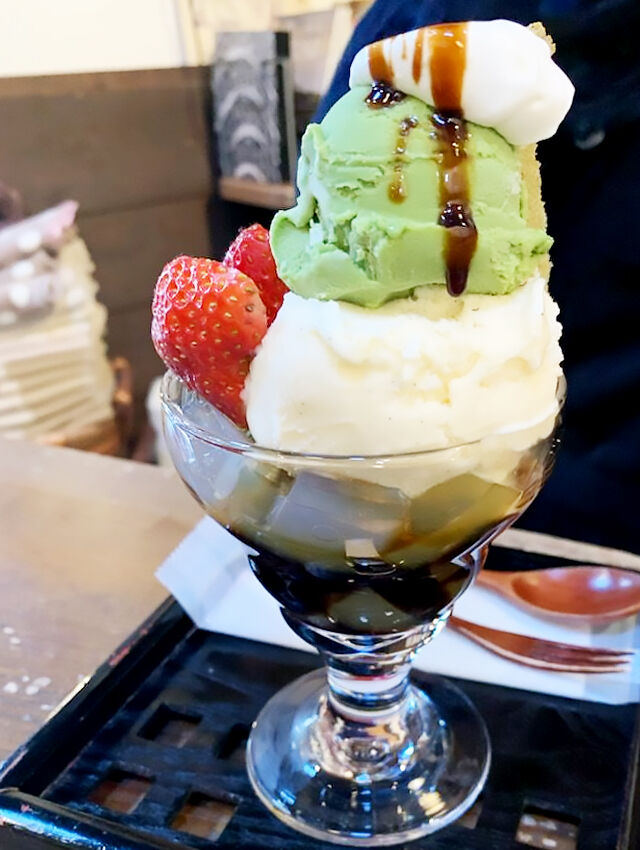
The width and height of the screenshot is (640, 850). I want to click on brown wood wall, so click(x=161, y=149).